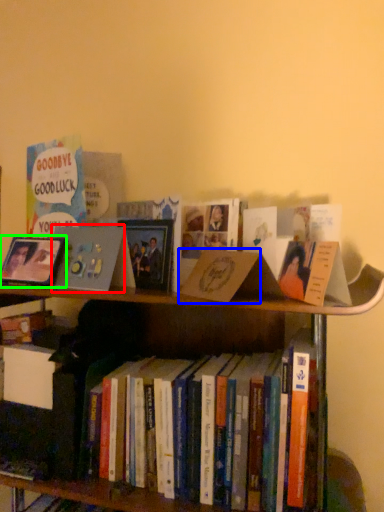
Question: Estimate the real-world distances between objects in this image. Which object is closer to book cover (highlighted by a red box), paperback book (highlighted by a blue box) or picture frame (highlighted by a green box)?

Choices:
 (A) paperback book
 (B) picture frame

Answer: (B)